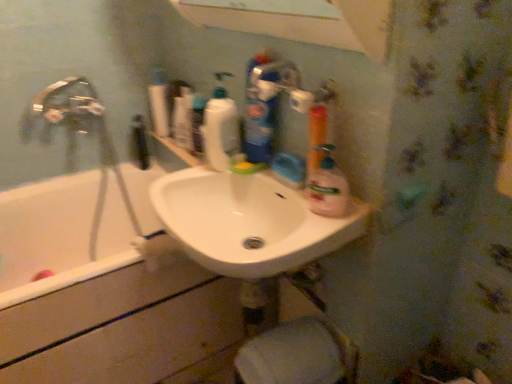
Identify the location of free space to the left of black glossy bottle at upper center. (109, 167).